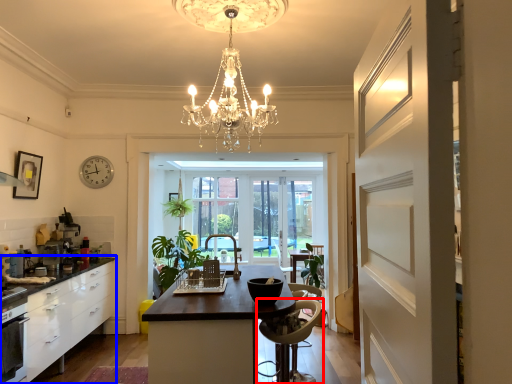
Question: Which object appears closest to the camera in this image, chair (highlighted by a red box) or cabinetry (highlighted by a blue box)?

Choices:
 (A) chair
 (B) cabinetry

Answer: (A)